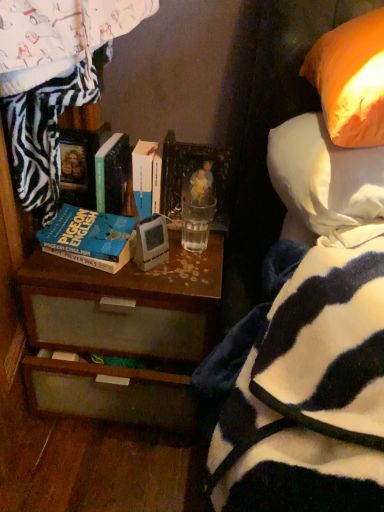
At what (x,y) coordinates should I click in order to perform the action: click on free space in front of clear glass at center. Please return your answer as a coordinate pair (x, y). Looking at the image, I should click on (185, 272).